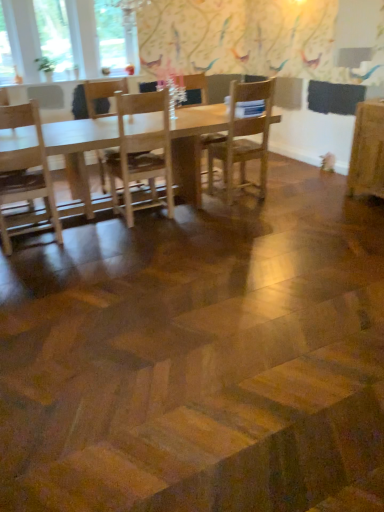
Question: In the image, is wooden chair at center, the 2th chair viewed from the right, on the left side or the right side of clear glass window at upper left, which appears as the 3th window when viewed from the left?

Choices:
 (A) left
 (B) right

Answer: (B)

Question: In terms of size, does wooden chair at center, the 2th chair viewed from the right, appear bigger or smaller than clear glass window at upper left, which appears as the 3th window when viewed from the left?

Choices:
 (A) small
 (B) big

Answer: (B)

Question: Which is farther from the clear glass window at upper left, the second window positioned from the left?

Choices:
 (A) wooden chair at center, the 2th chair viewed from the right
 (B) light wood table at center
 (C) white glass window at upper left, marked as the 1th window in a left-to-right arrangement
 (D) clear glass window at upper left, which is the first window from right to left
 (E) wooden chair at center, the 1th chair viewed from the left

Answer: (B)

Question: Based on their relative distances, which object is nearer to the clear glass window at upper left, the second window positioned from the left?

Choices:
 (A) light wood table at center
 (B) wooden chair at center, which appears as the third chair when viewed from the left
 (C) wooden chair at center, which is the 3th chair in right-to-left order
 (D) white glass window at upper left, marked as the 1th window in a left-to-right arrangement
 (E) wooden chair at center, the 2th chair viewed from the right

Answer: (D)